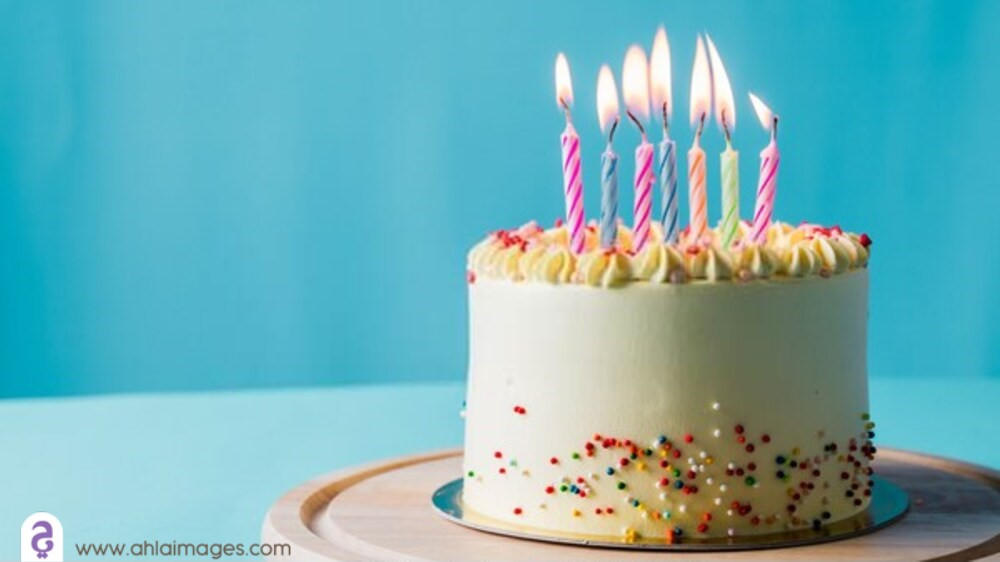
At what (x,y) coordinates should I click in order to perform the action: click on candle wicks. Please return your answer as a coordinate pair (x, y). Looking at the image, I should click on (571, 108), (612, 126), (634, 117), (664, 111), (703, 119), (723, 117), (771, 117).